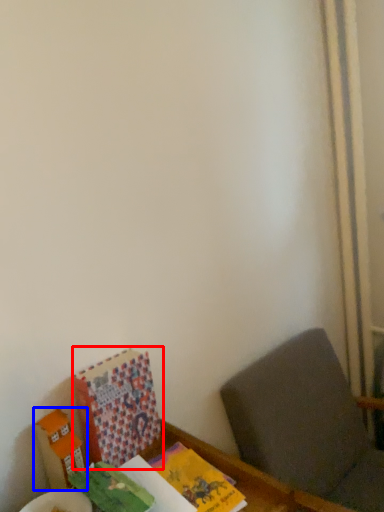
Question: Which object appears farthest to the camera in this image, book (highlighted by a red box) or cardboard box (highlighted by a blue box)?

Choices:
 (A) book
 (B) cardboard box

Answer: (A)